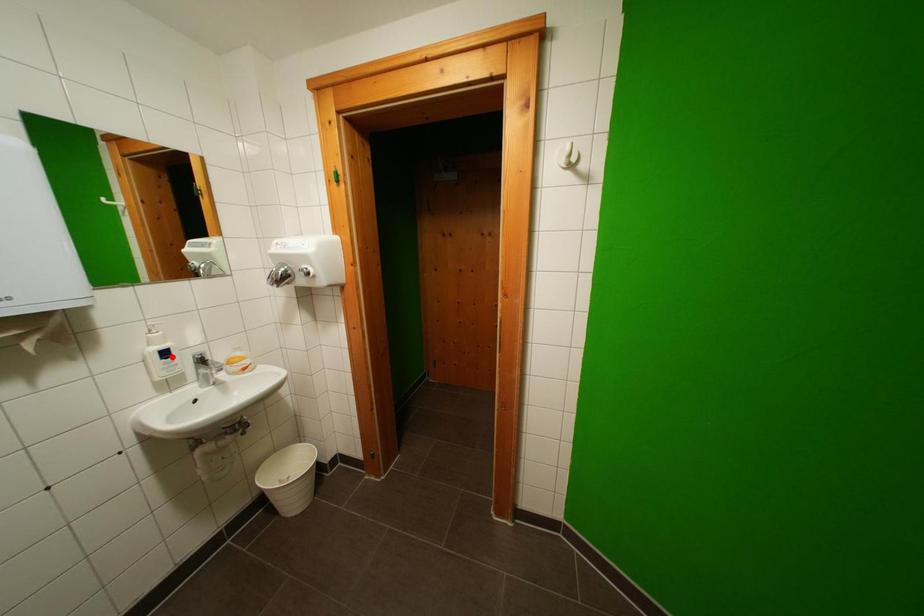
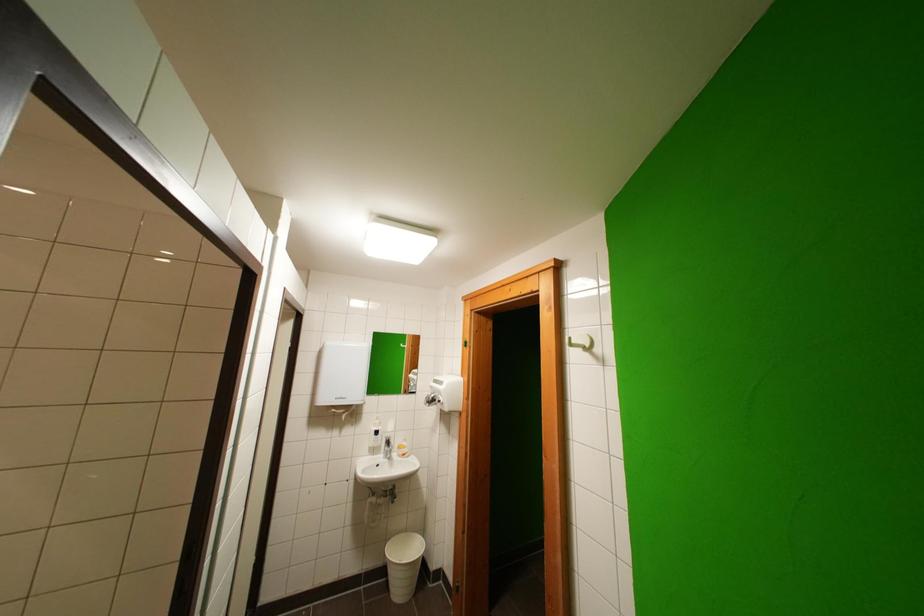
Question: I am providing you with two images of the same scene from different viewpoints. Image1 has a red point marked. In image2, the corresponding 3D location appears at what relative position? Reply with the corresponding letter.

Choices:
 (A) Closer
 (B) Farther

Answer: (B)